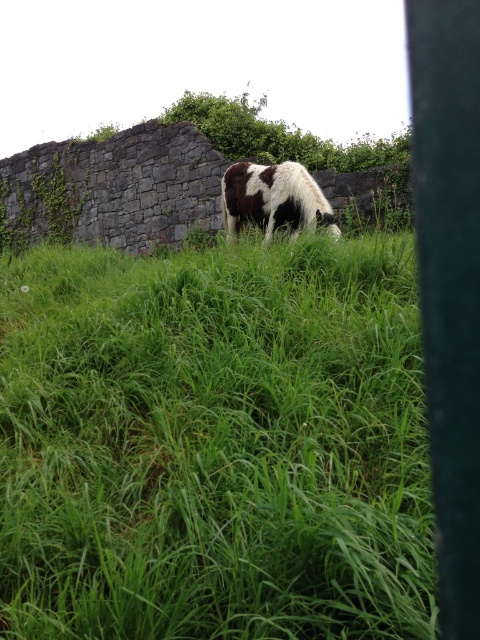
Between green grass at center and spotted fur cow at center, which one has more height?

With more height is green grass at center.

Does green grass at center have a greater height compared to spotted fur cow at center?

Yes.

Who is more distant from viewer, (173,472) or (325,221)?

The point (325,221) is behind.

Image resolution: width=480 pixels, height=640 pixels. What are the coordinates of `green grass at center` in the screenshot? It's located at (215, 444).